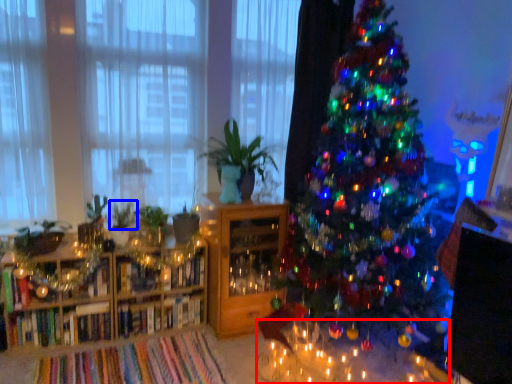
Question: Which point is further to the camera, table (highlighted by a red box) or plant (highlighted by a blue box)?

Choices:
 (A) table
 (B) plant

Answer: (B)